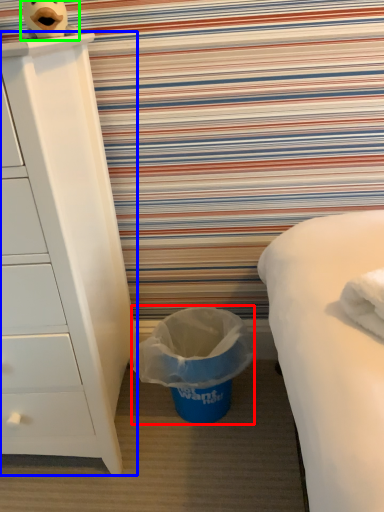
Question: Which object is the closest to the garbage (highlighted by a red box)? Choose among these: chest of drawers (highlighted by a blue box) or toy (highlighted by a green box).

Choices:
 (A) chest of drawers
 (B) toy

Answer: (A)